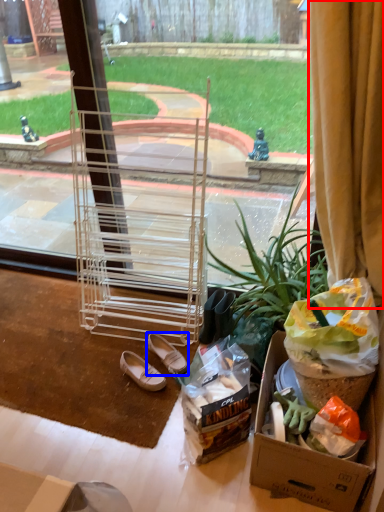
Question: Among these objects, which one is farthest to the camera, curtain (highlighted by a red box) or footwear (highlighted by a blue box)?

Choices:
 (A) curtain
 (B) footwear

Answer: (B)